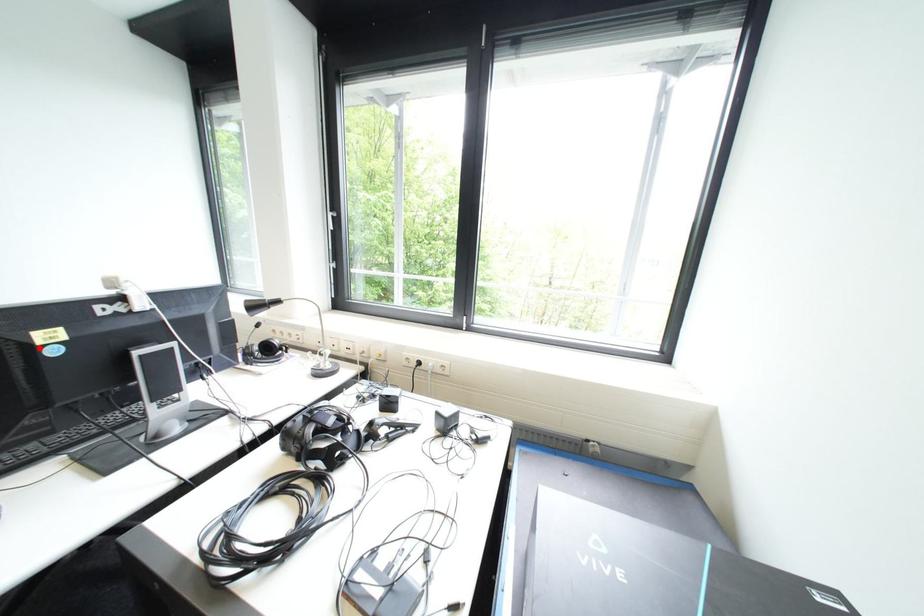
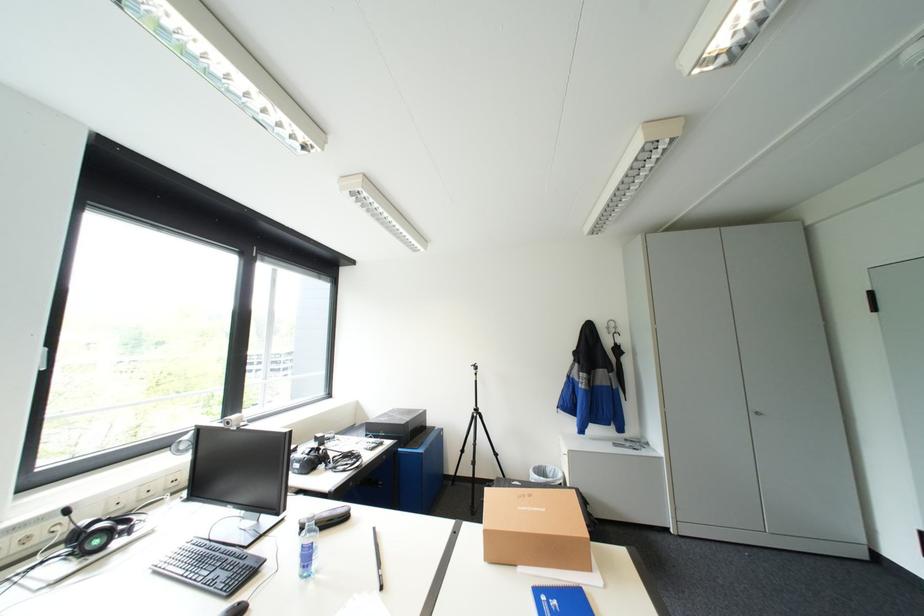
Question: I am providing you with two images of the same scene from different viewpoints. A red point is marked on the first image. Can you still see the location of the red point in image 2?

Choices:
 (A) Yes
 (B) No

Answer: (B)